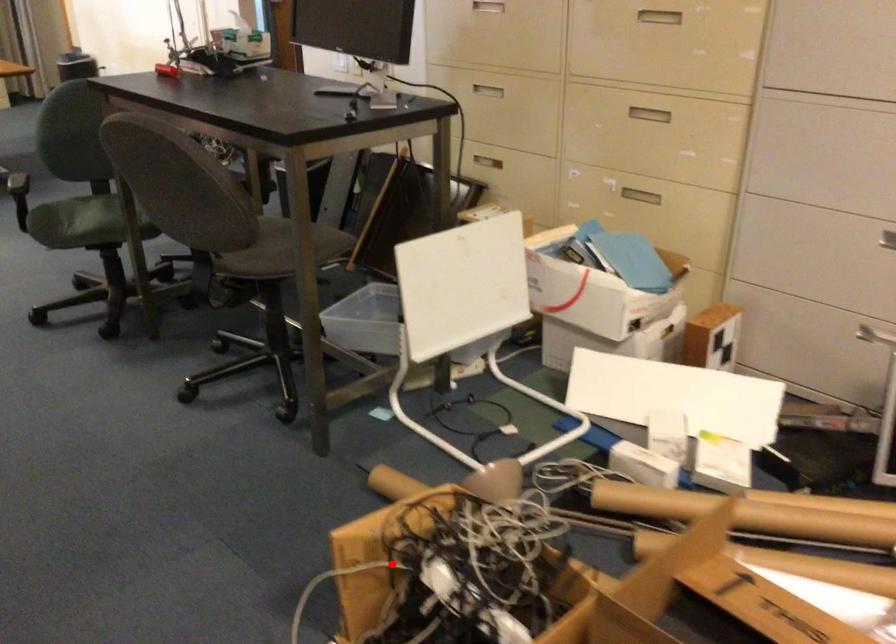
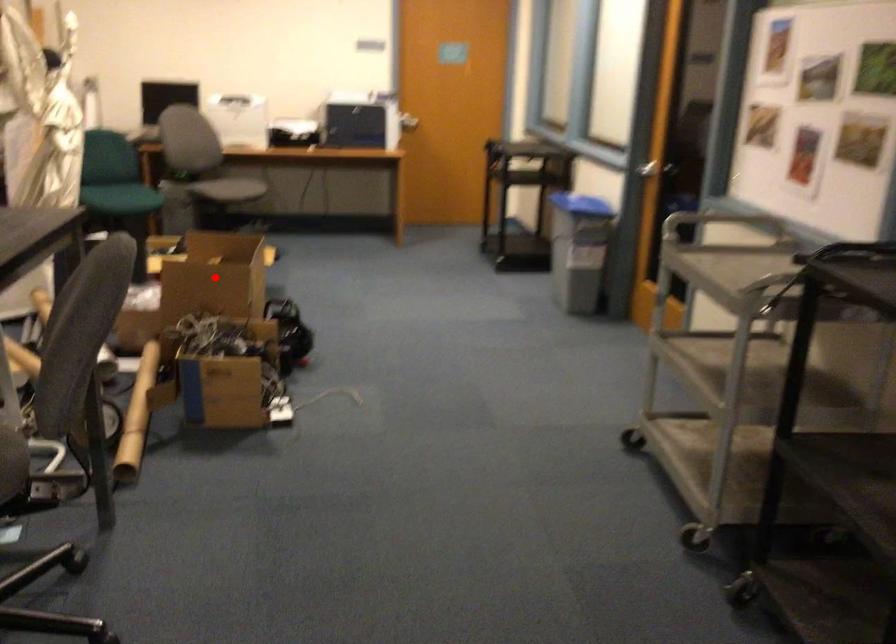
I am providing you with two images of the same scene from different viewpoints. A red point is marked on the first image and another point is marked on the second image. Does the point marked in image1 correspond to the same location as the one in image2?

No